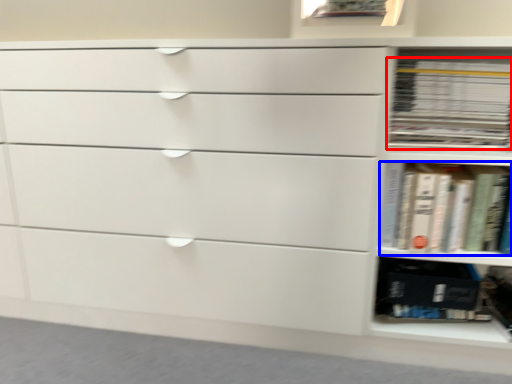
Question: Which of the following is the closest to the observer, book (highlighted by a red box) or book (highlighted by a blue box)?

Choices:
 (A) book
 (B) book

Answer: (B)